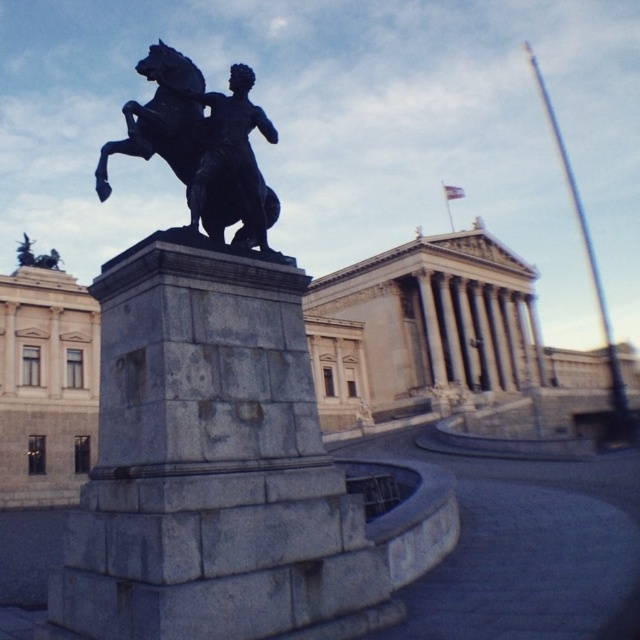
Question: Which point appears closest to the camera in this image?

Choices:
 (A) (396, 618)
 (B) (170, 134)

Answer: (A)

Question: Which object is positioned farthest from the polished bronze statue at center?

Choices:
 (A) black polished stone statue at center
 (B) polished bronze horse at center

Answer: (B)

Question: Can you confirm if polished bronze statue at center is positioned above polished bronze horse at center?

Choices:
 (A) no
 (B) yes

Answer: (A)

Question: Which of the following is the closest to the observer?

Choices:
 (A) (180, 260)
 (B) (237, 113)
 (C) (182, 132)

Answer: (A)

Question: Is polished bronze statue at center wider than polished bronze horse at center?

Choices:
 (A) no
 (B) yes

Answer: (B)

Question: Does black polished stone statue at center have a smaller size compared to polished bronze statue at center?

Choices:
 (A) yes
 (B) no

Answer: (B)